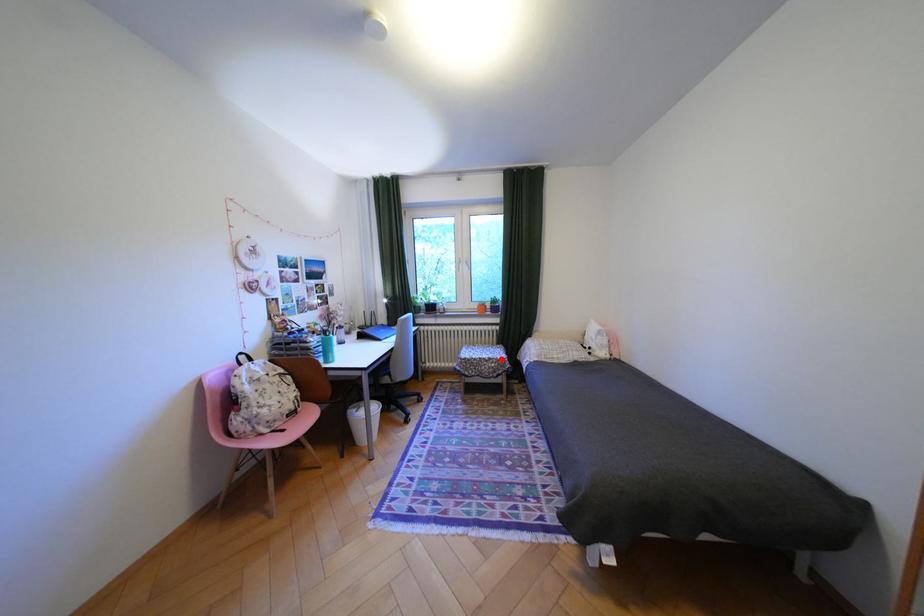
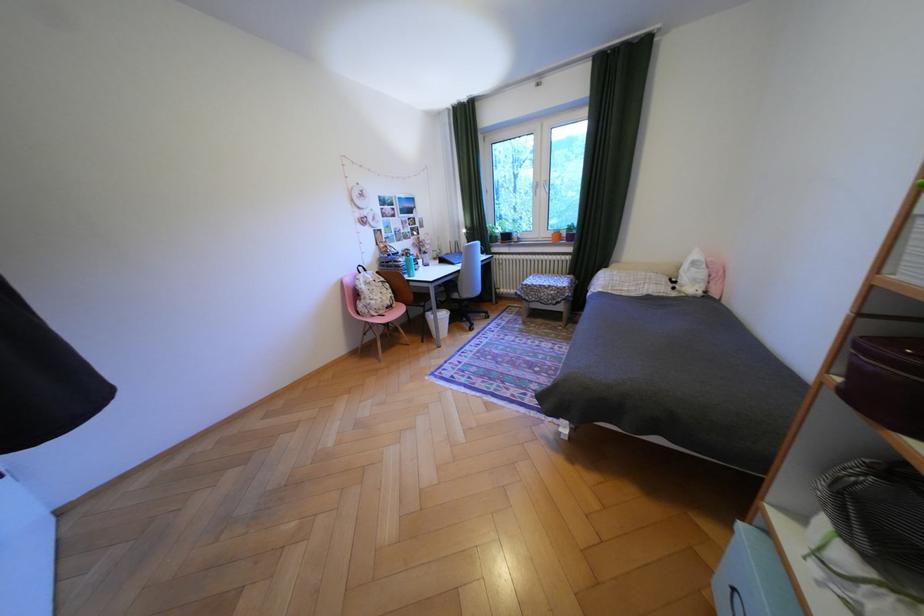
In the second image, find the point that corresponds to the highlighted location in the first image.

(562, 286)